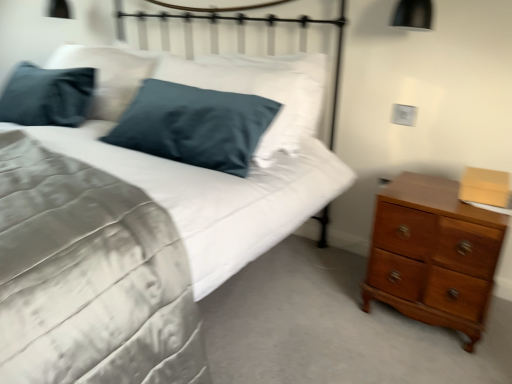
Question: Can you confirm if metallic white headboard at upper center is bigger than satin blue pillow at upper left?

Choices:
 (A) no
 (B) yes

Answer: (A)

Question: Would you say metallic white headboard at upper center is outside satin blue pillow at upper left?

Choices:
 (A) yes
 (B) no

Answer: (A)

Question: From the image's perspective, is metallic white headboard at upper center below satin blue pillow at upper left?

Choices:
 (A) no
 (B) yes

Answer: (A)

Question: Does metallic white headboard at upper center have a lesser height compared to satin blue pillow at upper left?

Choices:
 (A) yes
 (B) no

Answer: (A)

Question: Can you confirm if metallic white headboard at upper center is smaller than satin blue pillow at upper left?

Choices:
 (A) yes
 (B) no

Answer: (A)

Question: Is metallic white headboard at upper center thinner than satin blue pillow at upper left?

Choices:
 (A) no
 (B) yes

Answer: (B)

Question: From the image's perspective, is shiny brown wooden chest of drawers at right on black matte lampshade at upper right?

Choices:
 (A) no
 (B) yes

Answer: (A)

Question: Can you confirm if shiny brown wooden chest of drawers at right is wider than black matte lampshade at upper right?

Choices:
 (A) no
 (B) yes

Answer: (B)

Question: From a real-world perspective, is shiny brown wooden chest of drawers at right over black matte lampshade at upper right?

Choices:
 (A) yes
 (B) no

Answer: (B)

Question: Does shiny brown wooden chest of drawers at right lie behind black matte lampshade at upper right?

Choices:
 (A) no
 (B) yes

Answer: (A)

Question: Does shiny brown wooden chest of drawers at right turn towards black matte lampshade at upper right?

Choices:
 (A) no
 (B) yes

Answer: (A)

Question: Is there a large distance between shiny brown wooden chest of drawers at right and black matte lampshade at upper right?

Choices:
 (A) no
 (B) yes

Answer: (A)

Question: Considering the relative sizes of metallic white headboard at upper center and shiny brown wooden chest of drawers at right in the image provided, is metallic white headboard at upper center shorter than shiny brown wooden chest of drawers at right?

Choices:
 (A) no
 (B) yes

Answer: (A)